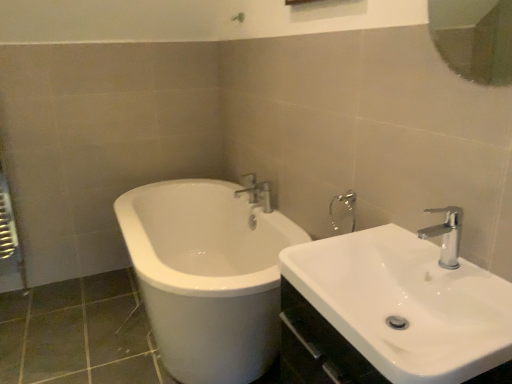
Question: In terms of height, does glossy glass mirror at upper right look taller or shorter compared to chrome metallic faucet at upper center, the first tap viewed from the left?

Choices:
 (A) short
 (B) tall

Answer: (B)

Question: Is point click(x=456, y=6) closer or farther from the camera than point click(x=236, y=196)?

Choices:
 (A) farther
 (B) closer

Answer: (A)

Question: Which of these objects is positioned closest to the chrome metallic faucet at upper right, which ranks as the 1th tap in right-to-left order?

Choices:
 (A) chrome metallic faucet at upper center, acting as the 2th tap starting from the front
 (B) white glossy sink at lower right
 (C) glossy glass mirror at upper right

Answer: (B)

Question: Which is farther from the chrome metallic faucet at upper center, the second tap when ordered from right to left?

Choices:
 (A) glossy glass mirror at upper right
 (B) chrome metallic faucet at upper right, the second tap when ordered from left to right
 (C) white glossy sink at lower right

Answer: (A)